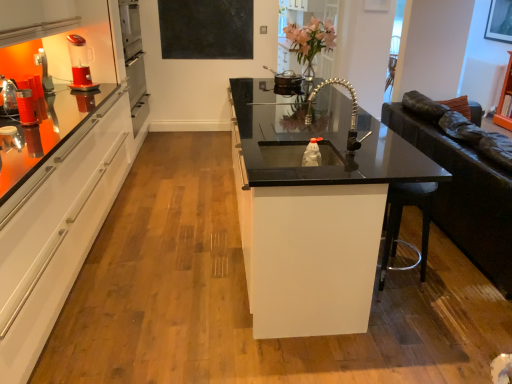
Question: From the image's perspective, does matte plastic cup at left, marked as the first appliance in a bottom-to-top arrangement, appear higher than pink glass vase at upper center?

Choices:
 (A) no
 (B) yes

Answer: (A)

Question: Can you confirm if matte plastic cup at left, marked as the first appliance in a bottom-to-top arrangement, is positioned to the right of pink glass vase at upper center?

Choices:
 (A) yes
 (B) no

Answer: (B)

Question: From the image's perspective, does matte plastic cup at left, which ranks as the 2th appliance in top-to-bottom order, appear lower than pink glass vase at upper center?

Choices:
 (A) yes
 (B) no

Answer: (A)

Question: Is the depth of matte plastic cup at left, which is the 1th appliance in front-to-back order, greater than that of pink glass vase at upper center?

Choices:
 (A) yes
 (B) no

Answer: (B)

Question: Is matte plastic cup at left, which ranks as the 2th appliance in top-to-bottom order, beside pink glass vase at upper center?

Choices:
 (A) no
 (B) yes

Answer: (A)

Question: From the image's perspective, is black glass countertop at center located above or below black matte board at upper center?

Choices:
 (A) above
 (B) below

Answer: (B)

Question: Is black glass countertop at center bigger or smaller than black matte board at upper center?

Choices:
 (A) big
 (B) small

Answer: (A)

Question: Is black glass countertop at center inside or outside of black matte board at upper center?

Choices:
 (A) inside
 (B) outside

Answer: (B)

Question: Does point (273, 198) appear closer or farther from the camera than point (202, 46)?

Choices:
 (A) closer
 (B) farther

Answer: (A)

Question: Choose the correct answer: Is matte black picture frame at upper right inside black glass countertop at center or outside it?

Choices:
 (A) outside
 (B) inside

Answer: (A)

Question: Looking at the image, does matte black picture frame at upper right seem bigger or smaller compared to black glass countertop at center?

Choices:
 (A) big
 (B) small

Answer: (B)

Question: From the image's perspective, relative to black glass countertop at center, is matte black picture frame at upper right above or below?

Choices:
 (A) above
 (B) below

Answer: (A)

Question: Does point (505, 16) appear closer or farther from the camera than point (263, 195)?

Choices:
 (A) farther
 (B) closer

Answer: (A)

Question: Visually, is matte plastic cup at left, the 2th appliance from the back, positioned to the left or to the right of metallic silver pot at upper center, the 2th appliance viewed from the left?

Choices:
 (A) right
 (B) left

Answer: (B)

Question: In terms of width, does matte plastic cup at left, marked as the first appliance in a bottom-to-top arrangement, look wider or thinner when compared to metallic silver pot at upper center, which ranks as the 1th appliance in back-to-front order?

Choices:
 (A) thin
 (B) wide

Answer: (A)